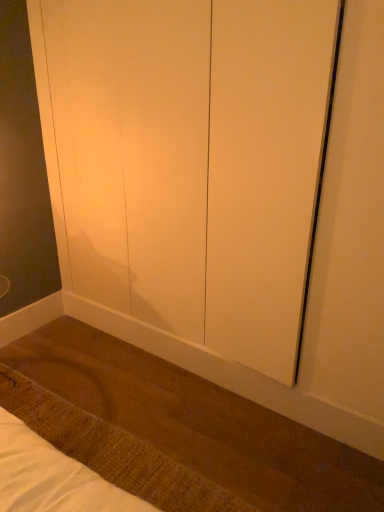
Question: Is matte white screen door at center placed right next to brown woven mat at lower left?

Choices:
 (A) no
 (B) yes

Answer: (A)

Question: From a real-world perspective, is matte white screen door at center positioned under brown woven mat at lower left based on gravity?

Choices:
 (A) yes
 (B) no

Answer: (B)

Question: From the image's perspective, would you say matte white screen door at center is shown under brown woven mat at lower left?

Choices:
 (A) no
 (B) yes

Answer: (A)

Question: From the image's perspective, is matte white screen door at center over brown woven mat at lower left?

Choices:
 (A) yes
 (B) no

Answer: (A)

Question: Is matte white screen door at center positioned before brown woven mat at lower left?

Choices:
 (A) yes
 (B) no

Answer: (A)

Question: Can you confirm if matte white screen door at center is positioned to the left of brown woven mat at lower left?

Choices:
 (A) no
 (B) yes

Answer: (A)

Question: Considering the relative sizes of brown woven mat at lower left and matte white screen door at center in the image provided, is brown woven mat at lower left bigger than matte white screen door at center?

Choices:
 (A) yes
 (B) no

Answer: (B)

Question: Would you say brown woven mat at lower left contains matte white screen door at center?

Choices:
 (A) no
 (B) yes

Answer: (A)

Question: Is brown woven mat at lower left wider than matte white screen door at center?

Choices:
 (A) yes
 (B) no

Answer: (A)

Question: Is brown woven mat at lower left located outside matte white screen door at center?

Choices:
 (A) no
 (B) yes

Answer: (B)

Question: Considering the relative sizes of brown woven mat at lower left and matte white screen door at center in the image provided, is brown woven mat at lower left taller than matte white screen door at center?

Choices:
 (A) yes
 (B) no

Answer: (B)

Question: Is brown woven mat at lower left turned away from matte white screen door at center?

Choices:
 (A) yes
 (B) no

Answer: (B)

Question: From the image's perspective, is matte white screen door at center located above or below brown woven mat at lower left?

Choices:
 (A) above
 (B) below

Answer: (A)